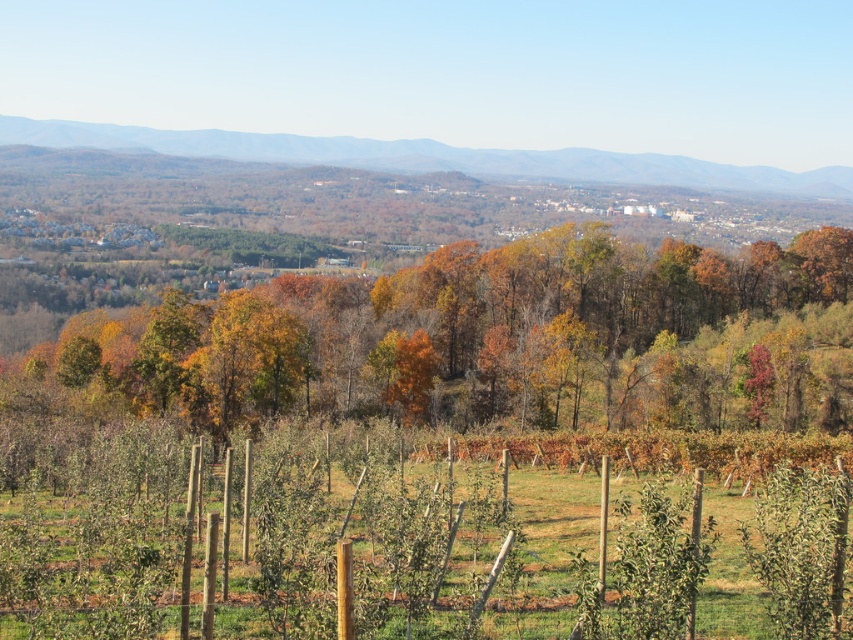
Between point (450, 269) and point (248, 141), which one is positioned in front?

Point (450, 269) is more forward.

Describe the element at coordinates (474, 337) in the screenshot. I see `autumn leaves at center` at that location.

Is point (173, 301) in front of point (833, 192)?

Yes, point (173, 301) is in front of point (833, 192).

Find the location of a particular element. This screenshot has height=640, width=853. autumn leaves at center is located at coordinates click(x=474, y=337).